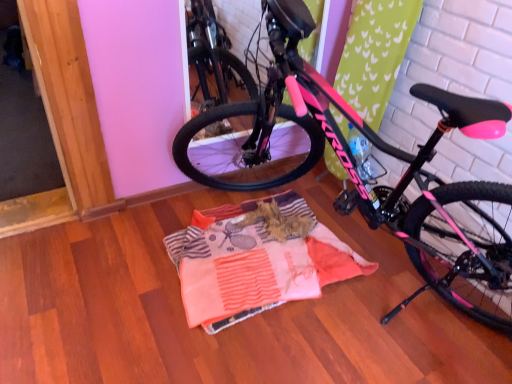
Image resolution: width=512 pixels, height=384 pixels. What do you see at coordinates (365, 181) in the screenshot?
I see `pink matte bicycle at center` at bounding box center [365, 181].

Where is `pink matte bicycle at center`? pink matte bicycle at center is located at coordinates (365, 181).

What is the approximate width of striped cotton blanket at center?

The width of striped cotton blanket at center is 32.48 inches.

What do you see at coordinates (256, 259) in the screenshot?
I see `striped cotton blanket at center` at bounding box center [256, 259].

The width and height of the screenshot is (512, 384). What are the coordinates of `striped cotton blanket at center` in the screenshot? It's located at (256, 259).

The image size is (512, 384). In order to click on pink matte bicycle at center in this screenshot , I will do `click(365, 181)`.

Between pink matte bicycle at center and striped cotton blanket at center, which one appears on the right side from the viewer's perspective?

Positioned to the right is pink matte bicycle at center.

Is pink matte bicycle at center behind striped cotton blanket at center?

No.

Which is in front, point (220, 161) or point (298, 290)?

The point (298, 290) is closer.

From the image's perspective, is pink matte bicycle at center over striped cotton blanket at center?

Correct, pink matte bicycle at center appears higher than striped cotton blanket at center in the image.

From a real-world perspective, does pink matte bicycle at center sit lower than striped cotton blanket at center?

No, from a real-world perspective, pink matte bicycle at center is not under striped cotton blanket at center.

Can you confirm if pink matte bicycle at center is wider than striped cotton blanket at center?

Correct, the width of pink matte bicycle at center exceeds that of striped cotton blanket at center.

Is pink matte bicycle at center shorter than striped cotton blanket at center?

In fact, pink matte bicycle at center may be taller than striped cotton blanket at center.

Does pink matte bicycle at center have a larger size compared to striped cotton blanket at center?

Yes.

Is pink matte bicycle at center not within striped cotton blanket at center?

That's correct, pink matte bicycle at center is outside of striped cotton blanket at center.

Are pink matte bicycle at center and striped cotton blanket at center beside each other?

No, pink matte bicycle at center is not beside striped cotton blanket at center.

Is pink matte bicycle at center oriented away from striped cotton blanket at center?

No, pink matte bicycle at center's orientation is not away from striped cotton blanket at center.

Looking at this image, measure the distance between pink matte bicycle at center and striped cotton blanket at center.

The distance of pink matte bicycle at center from striped cotton blanket at center is 42.06 centimeters.

Where is `blanket located behind the pink matte bicycle at center`? This screenshot has width=512, height=384. blanket located behind the pink matte bicycle at center is located at coordinates (256, 259).

Which is more to the right, striped cotton blanket at center or pink matte bicycle at center?

pink matte bicycle at center.

Which is in front, striped cotton blanket at center or pink matte bicycle at center?

Positioned in front is pink matte bicycle at center.

Is point (309, 289) closer or farther from the camera than point (376, 202)?

Point (309, 289) is farther from the camera than point (376, 202).

From the image's perspective, is striped cotton blanket at center positioned above or below pink matte bicycle at center?

striped cotton blanket at center is situated lower than pink matte bicycle at center in the image.

From a real-world perspective, between striped cotton blanket at center and pink matte bicycle at center, who is vertically higher?

pink matte bicycle at center is physically above.

Considering the relative sizes of striped cotton blanket at center and pink matte bicycle at center in the image provided, is striped cotton blanket at center thinner than pink matte bicycle at center?

Yes, striped cotton blanket at center is thinner than pink matte bicycle at center.

Who is shorter, striped cotton blanket at center or pink matte bicycle at center?

striped cotton blanket at center.

Considering the sizes of objects striped cotton blanket at center and pink matte bicycle at center in the image provided, who is bigger, striped cotton blanket at center or pink matte bicycle at center?

pink matte bicycle at center.

Is striped cotton blanket at center outside of pink matte bicycle at center?

No, striped cotton blanket at center is inside pink matte bicycle at center's boundary.

Can you see striped cotton blanket at center touching pink matte bicycle at center?

striped cotton blanket at center and pink matte bicycle at center are clearly separated.

Does striped cotton blanket at center turn towards pink matte bicycle at center?

Yes.

How many degrees apart are the facing directions of striped cotton blanket at center and pink matte bicycle at center?

87.9 degrees.

At what (x,y) coordinates should I click in order to perform the action: click on bicycle on the right of striped cotton blanket at center. Please return your answer as a coordinate pair (x, y). The image size is (512, 384). Looking at the image, I should click on 365,181.

Locate an element on the screen. The image size is (512, 384). blanket below the pink matte bicycle at center (from the image's perspective) is located at coordinates (256, 259).

This screenshot has width=512, height=384. Identify the location of bicycle above the striped cotton blanket at center (from the image's perspective). (365, 181).